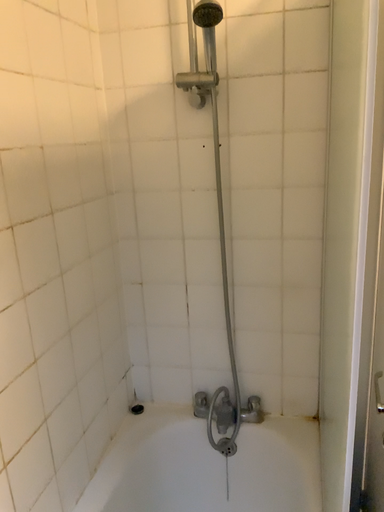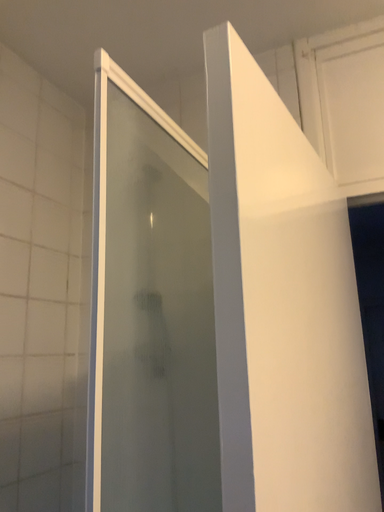
Question: How did the camera likely rotate when shooting the video?

Choices:
 (A) rotated downward
 (B) rotated upward

Answer: (B)